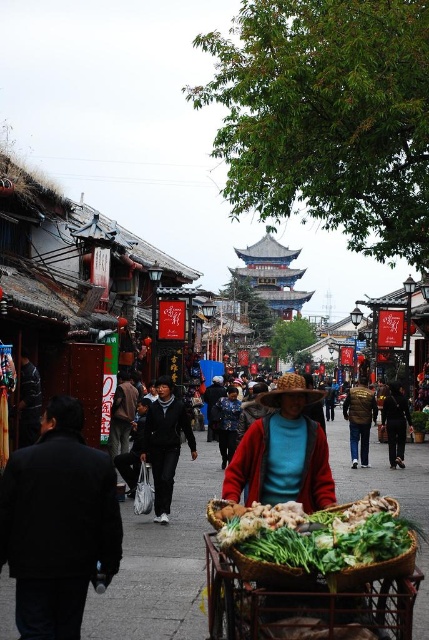
You are a customer in this market and want to buy some vegetables. You see the green leafy vegetables at lower center and the dark brown leather jacket at center. Which item is smaller in size?

The green leafy vegetables at lower center are smaller in size compared to the dark brown leather jacket at center.